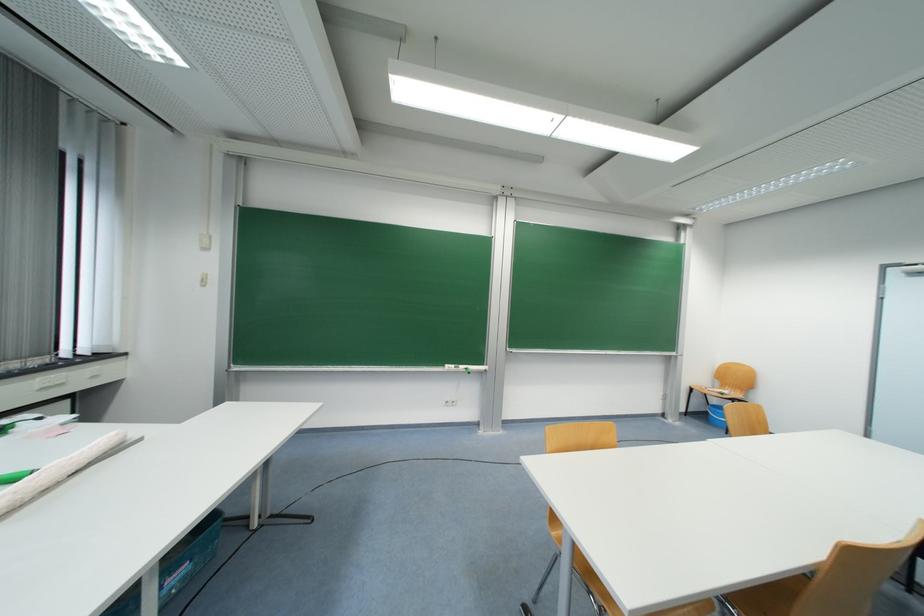
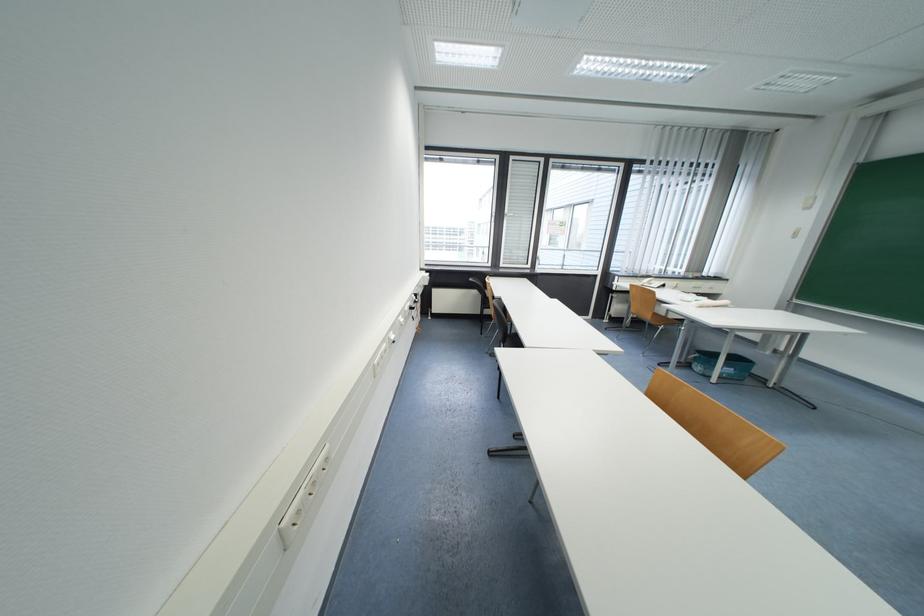
In the second image, find the point that corresponds to pixel 188 581 in the first image.

(734, 377)